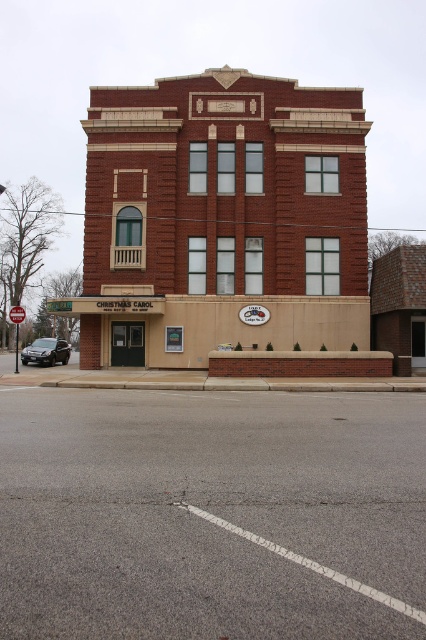
Question: Can you confirm if satin black sedan at lower left is positioned below brushed metal stop sign at upper center?

Choices:
 (A) no
 (B) yes

Answer: (B)

Question: Is satin black sedan at lower left bigger than brushed metal stop sign at upper center?

Choices:
 (A) no
 (B) yes

Answer: (B)

Question: Which point is closer to the camera taking this photo?

Choices:
 (A) (22, 349)
 (B) (17, 317)

Answer: (B)

Question: Which point is farther from the camera taking this photo?

Choices:
 (A) (19, 308)
 (B) (43, 342)

Answer: (B)

Question: Observing the image, what is the correct spatial positioning of satin black sedan at lower left in reference to brushed metal stop sign at upper center?

Choices:
 (A) above
 (B) below

Answer: (B)